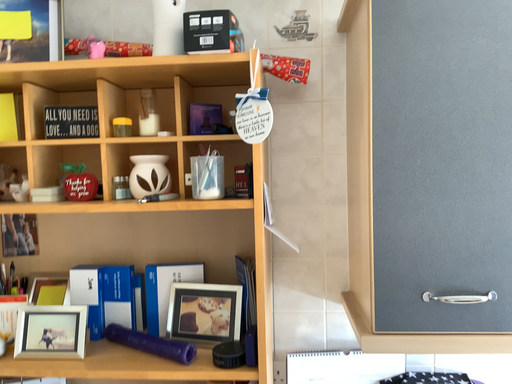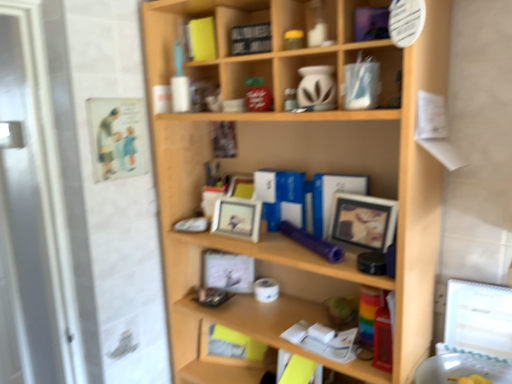
Question: How did the camera likely rotate when shooting the video?

Choices:
 (A) rotated downward
 (B) rotated upward

Answer: (A)